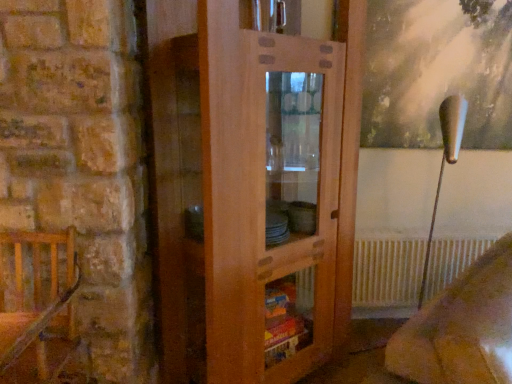
Question: Is velvet beige armchair at lower right wider or thinner than white metallic radiator at lower right?

Choices:
 (A) thin
 (B) wide

Answer: (B)

Question: Considering the positions of velvet beige armchair at lower right and white metallic radiator at lower right in the image, is velvet beige armchair at lower right taller or shorter than white metallic radiator at lower right?

Choices:
 (A) tall
 (B) short

Answer: (A)

Question: Which of these objects is positioned closest to the wooden cabinet at center?

Choices:
 (A) wooden chair at left
 (B) white metallic radiator at lower right
 (C) velvet beige armchair at lower right

Answer: (A)

Question: Which object is the farthest from the white metallic radiator at lower right?

Choices:
 (A) wooden chair at left
 (B) velvet beige armchair at lower right
 (C) wooden cabinet at center

Answer: (A)